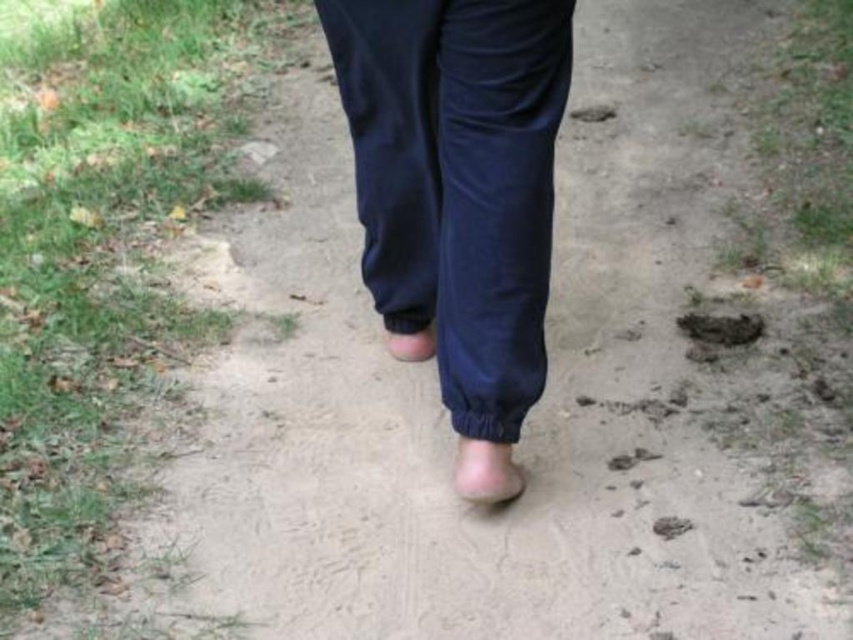
Question: Is navy blue fabric pants at center wider than matte skin foot at center?

Choices:
 (A) no
 (B) yes

Answer: (B)

Question: Which object appears farthest from the camera in this image?

Choices:
 (A) matte skin foot at center
 (B) navy blue fabric pants at center
 (C) brown dirt footprint at lower right

Answer: (A)

Question: Can you confirm if navy blue fabric pants at center is thinner than brown dirt footprint at center?

Choices:
 (A) yes
 (B) no

Answer: (B)

Question: Which of these objects is positioned farthest from the matte skin foot at center?

Choices:
 (A) brown dirt footprint at lower right
 (B) brown dirt footprint at center
 (C) navy blue fabric pants at center
 (D) pink matte foot at center

Answer: (B)

Question: Does navy blue fabric pants at center come in front of brown dirt footprint at lower right?

Choices:
 (A) no
 (B) yes

Answer: (B)

Question: Which of the following is the closest to the observer?

Choices:
 (A) matte skin foot at center
 (B) pink matte foot at center
 (C) navy blue fabric pants at center
 (D) brown dirt footprint at center

Answer: (C)